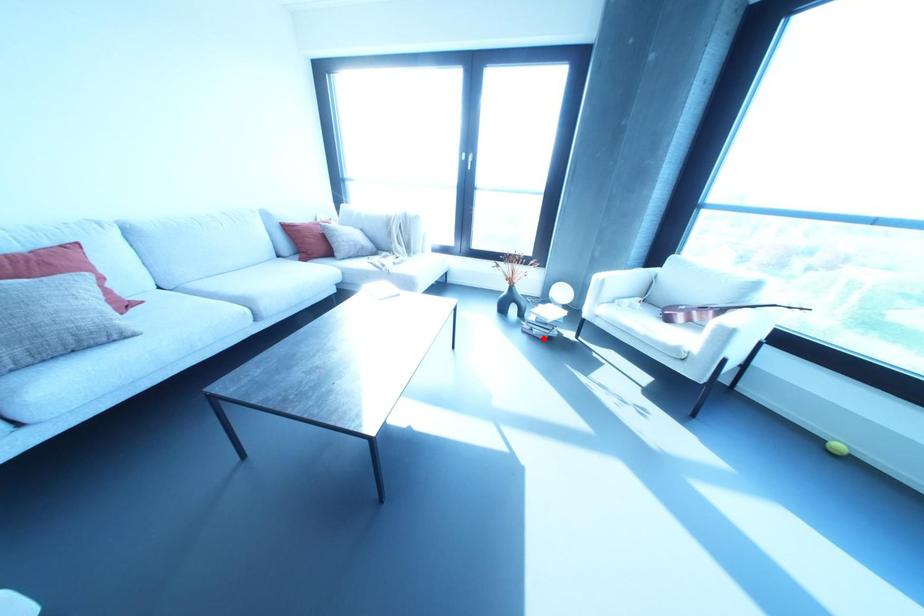
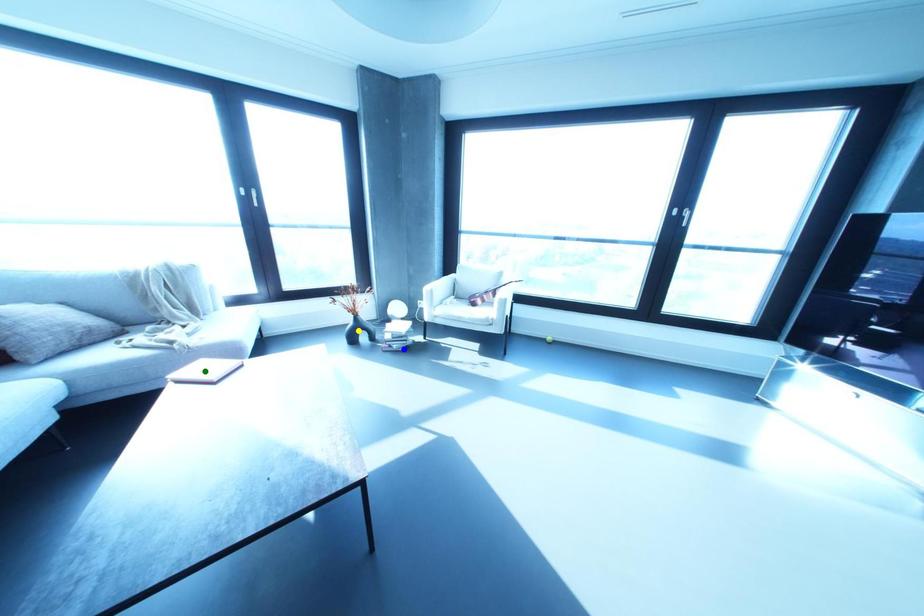
Question: I am providing you with two images of the same scene from different viewpoints. A red point is marked on the first image. You are given multiple points on the second image. In image 2, which mark is for the same physical point as the one in image 1?

Choices:
 (A) yellow point
 (B) blue point
 (C) green point

Answer: (B)